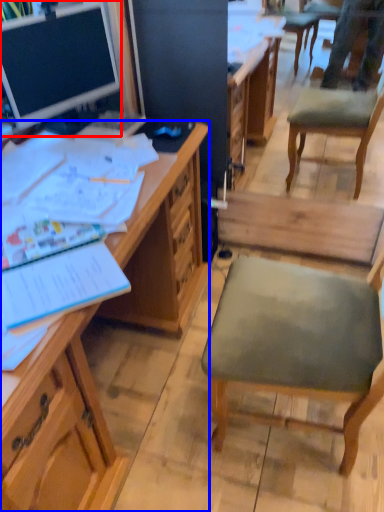
Question: Which object appears farthest to the camera in this image, desk (highlighted by a red box) or desk (highlighted by a blue box)?

Choices:
 (A) desk
 (B) desk

Answer: (A)